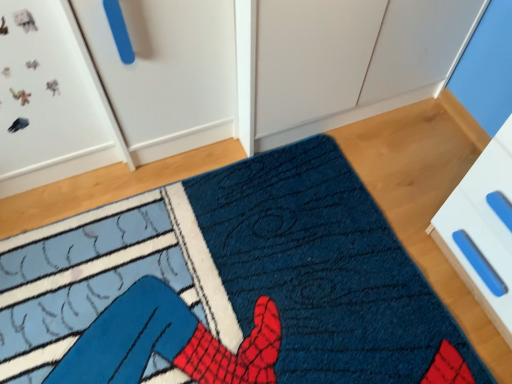
Where is `white plastic drawer at lower right`? white plastic drawer at lower right is located at coordinates (482, 232).

What do you see at coordinates (482, 232) in the screenshot? I see `white plastic drawer at lower right` at bounding box center [482, 232].

The image size is (512, 384). I want to click on textured blue rug at center, so click(257, 272).

Measure the distance between point (396,313) and camera.

They are 4.03 feet apart.

What do you see at coordinates (257, 272) in the screenshot?
I see `textured blue rug at center` at bounding box center [257, 272].

Find the location of a particular element. This screenshot has width=512, height=384. white plastic drawer at lower right is located at coordinates (482, 232).

Between white plastic drawer at lower right and textured blue rug at center, which one appears on the left side from the viewer's perspective?

textured blue rug at center.

Is white plastic drawer at lower right positioned in front of textured blue rug at center?

Yes, it is.

Which is in front, point (508, 190) or point (373, 300)?

The point (508, 190) is more forward.

From the image's perspective, between white plastic drawer at lower right and textured blue rug at center, which one is located above?

white plastic drawer at lower right, from the image's perspective.

From a real-world perspective, is white plastic drawer at lower right positioned above or below textured blue rug at center?

In terms of real-world spatial position, white plastic drawer at lower right is above textured blue rug at center.

Which of these two, white plastic drawer at lower right or textured blue rug at center, is thinner?

With smaller width is white plastic drawer at lower right.

Considering the sizes of white plastic drawer at lower right and textured blue rug at center in the image, is white plastic drawer at lower right taller or shorter than textured blue rug at center?

In the image, white plastic drawer at lower right appears to be taller than textured blue rug at center.

Considering the sizes of white plastic drawer at lower right and textured blue rug at center in the image, is white plastic drawer at lower right bigger or smaller than textured blue rug at center?

Considering their sizes, white plastic drawer at lower right takes up more space than textured blue rug at center.

In the scene shown: Which is correct: white plastic drawer at lower right is inside textured blue rug at center, or outside of it?

white plastic drawer at lower right is outside textured blue rug at center.

Is white plastic drawer at lower right far from textured blue rug at center?

Actually, white plastic drawer at lower right and textured blue rug at center are a little close together.

Is textured blue rug at center at the back of white plastic drawer at lower right?

No, textured blue rug at center is not at the back of white plastic drawer at lower right.

How different are the orientations of white plastic drawer at lower right and textured blue rug at center in degrees?

They differ by 180 degrees in their facing directions.

The image size is (512, 384). Find the location of `doormat behind the white plastic drawer at lower right`. doormat behind the white plastic drawer at lower right is located at coordinates (257, 272).

Is textured blue rug at center at the right side of white plastic drawer at lower right?

In fact, textured blue rug at center is to the left of white plastic drawer at lower right.

In the image, is textured blue rug at center positioned in front of or behind white plastic drawer at lower right?

textured blue rug at center is behind white plastic drawer at lower right.

Between point (334, 367) and point (466, 193), which one is positioned in front?

Positioned in front is point (466, 193).

From the image's perspective, is textured blue rug at center located above or below white plastic drawer at lower right?

textured blue rug at center is below white plastic drawer at lower right.

From a real-world perspective, is textured blue rug at center positioned under white plastic drawer at lower right based on gravity?

Yes, from a real-world perspective, textured blue rug at center is under white plastic drawer at lower right.

Looking at their sizes, would you say textured blue rug at center is wider or thinner than white plastic drawer at lower right?

textured blue rug at center is wider than white plastic drawer at lower right.

Which of these two, textured blue rug at center or white plastic drawer at lower right, stands taller?

Standing taller between the two is white plastic drawer at lower right.

Is textured blue rug at center smaller than white plastic drawer at lower right?

Correct, textured blue rug at center occupies less space than white plastic drawer at lower right.

Looking at this image, is white plastic drawer at lower right located within textured blue rug at center?

No, white plastic drawer at lower right is not surrounded by textured blue rug at center.

Are textured blue rug at center and white plastic drawer at lower right making contact?

No, textured blue rug at center is not with white plastic drawer at lower right.

Could you tell me if textured blue rug at center is turned towards white plastic drawer at lower right?

No, textured blue rug at center is not facing towards white plastic drawer at lower right.

Find the location of a particular element. This screenshot has width=512, height=384. drawer lying in front of the textured blue rug at center is located at coordinates (482, 232).

The width and height of the screenshot is (512, 384). Find the location of `doormat below the white plastic drawer at lower right (from a real-world perspective)`. doormat below the white plastic drawer at lower right (from a real-world perspective) is located at coordinates (257, 272).

Locate an element on the screen. Image resolution: width=512 pixels, height=384 pixels. drawer above the textured blue rug at center (from a real-world perspective) is located at coordinates (482, 232).